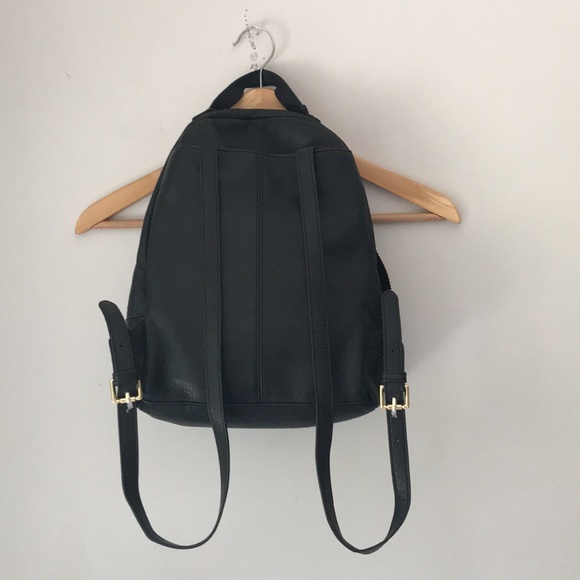
Identify the location of hanger hook. The height and width of the screenshot is (580, 580). (266, 58).